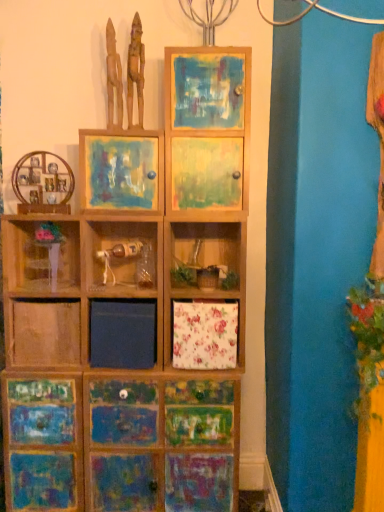
Question: Could you tell me if wooden shelf at left, marked as the 3th cabinetry in a bottom-to-top arrangement, is facing painted wood cabinet at upper center?

Choices:
 (A) yes
 (B) no

Answer: (B)

Question: From the image's perspective, does wooden shelf at left, the 1th cabinetry from the top, appear higher than painted wood cabinet at upper center?

Choices:
 (A) no
 (B) yes

Answer: (A)

Question: Does wooden shelf at left, the 1th cabinetry from the top, have a greater width compared to painted wood cabinet at upper center?

Choices:
 (A) yes
 (B) no

Answer: (B)

Question: Can you confirm if wooden shelf at left, the 1th cabinetry from the top, is positioned to the left of painted wood cabinet at upper center?

Choices:
 (A) yes
 (B) no

Answer: (A)

Question: Is the depth of wooden shelf at left, marked as the 3th cabinetry in a bottom-to-top arrangement, greater than that of painted wood cabinet at upper center?

Choices:
 (A) no
 (B) yes

Answer: (B)

Question: Considering the positions of point (114, 38) and point (94, 162), is point (114, 38) closer or farther from the camera than point (94, 162)?

Choices:
 (A) farther
 (B) closer

Answer: (A)

Question: Looking at their shapes, would you say wooden figurines at upper center, which is counted as the 1th sculpture, starting from the left, is wider or thinner than painted wood picture frame at upper center?

Choices:
 (A) thin
 (B) wide

Answer: (A)

Question: Considering their positions, is wooden figurines at upper center, acting as the 2th sculpture starting from the right, located in front of or behind painted wood picture frame at upper center?

Choices:
 (A) behind
 (B) front

Answer: (A)

Question: From a real-world perspective, relative to painted wood picture frame at upper center, is wooden figurines at upper center, which is counted as the 1th sculpture, starting from the left, vertically above or below?

Choices:
 (A) below
 (B) above

Answer: (B)

Question: Do you think wooden painted cabinet at lower left, which appears as the 3th cabinetry when viewed from the top, is within wooden painted drawer at center, the 2th cabinetry positioned from the bottom, or outside of it?

Choices:
 (A) outside
 (B) inside

Answer: (A)

Question: Considering the relative positions of wooden painted cabinet at lower left, arranged as the first cabinetry when ordered from the bottom, and wooden painted drawer at center, the 2th cabinetry positioned from the bottom, in the image provided, is wooden painted cabinet at lower left, arranged as the first cabinetry when ordered from the bottom, to the left or to the right of wooden painted drawer at center, the 2th cabinetry positioned from the bottom,?

Choices:
 (A) left
 (B) right

Answer: (A)

Question: From their relative heights in the image, would you say wooden painted cabinet at lower left, arranged as the first cabinetry when ordered from the bottom, is taller or shorter than wooden painted drawer at center, the second cabinetry from the top?

Choices:
 (A) short
 (B) tall

Answer: (A)

Question: Does point (3, 463) appear closer or farther from the camera than point (23, 404)?

Choices:
 (A) closer
 (B) farther

Answer: (B)

Question: In terms of size, does wooden painted cabinet at lower left, which appears as the 3th cabinetry when viewed from the top, appear bigger or smaller than painted wood cabinet at upper center?

Choices:
 (A) big
 (B) small

Answer: (A)

Question: Visually, is wooden painted cabinet at lower left, which appears as the 3th cabinetry when viewed from the top, positioned to the left or to the right of painted wood cabinet at upper center?

Choices:
 (A) left
 (B) right

Answer: (A)